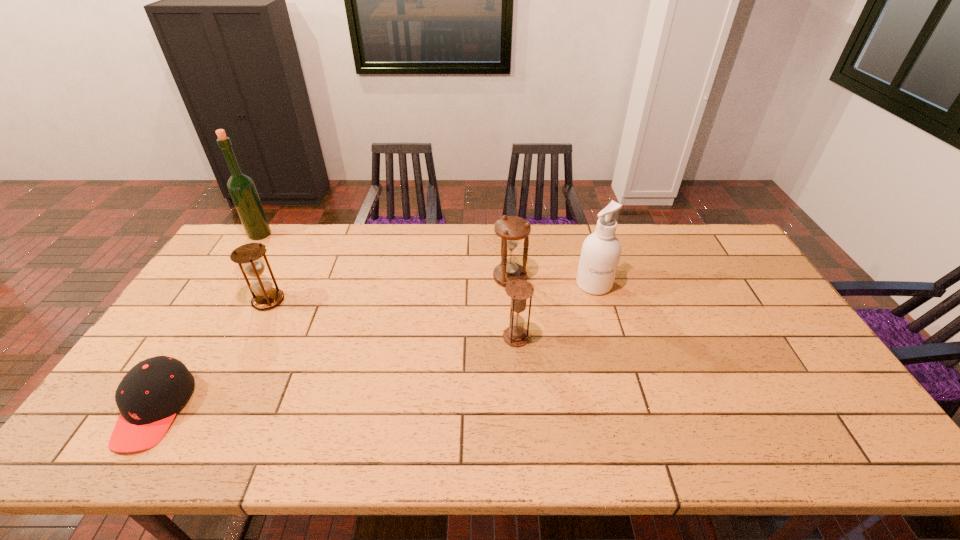
The height and width of the screenshot is (540, 960). Identify the location of object present at the near left corner. (149, 396).

Where is `vacant space at the far edge of the desktop`? vacant space at the far edge of the desktop is located at coordinates (660, 227).

You are a GUI agent. You are given a task and a screenshot of the screen. Output one action in this format:
    pyautogui.click(x=<x>, y=<y>)
    Task: Click on the vacant region at the near edge of the desktop
    This screenshot has width=960, height=540.
    Given the screenshot: What is the action you would take?
    pyautogui.click(x=417, y=449)

The image size is (960, 540). What are the coordinates of `blank space at the left edge of the desktop` in the screenshot? It's located at (230, 269).

This screenshot has height=540, width=960. I want to click on free space at the right edge of the desktop, so [768, 373].

Locate an element on the screen. The width and height of the screenshot is (960, 540). vacant space at the far right corner is located at coordinates (696, 232).

Image resolution: width=960 pixels, height=540 pixels. What are the coordinates of `vacant region between the shortest object and the farthest hourglass` in the screenshot? It's located at (332, 344).

I want to click on vacant area between the third object from left to right and the cap, so click(x=211, y=355).

I want to click on vacant area between the tallest object and the rightmost object, so click(427, 259).

Where is `empty space between the liquor and the shortest object`? The height and width of the screenshot is (540, 960). empty space between the liquor and the shortest object is located at coordinates (207, 322).